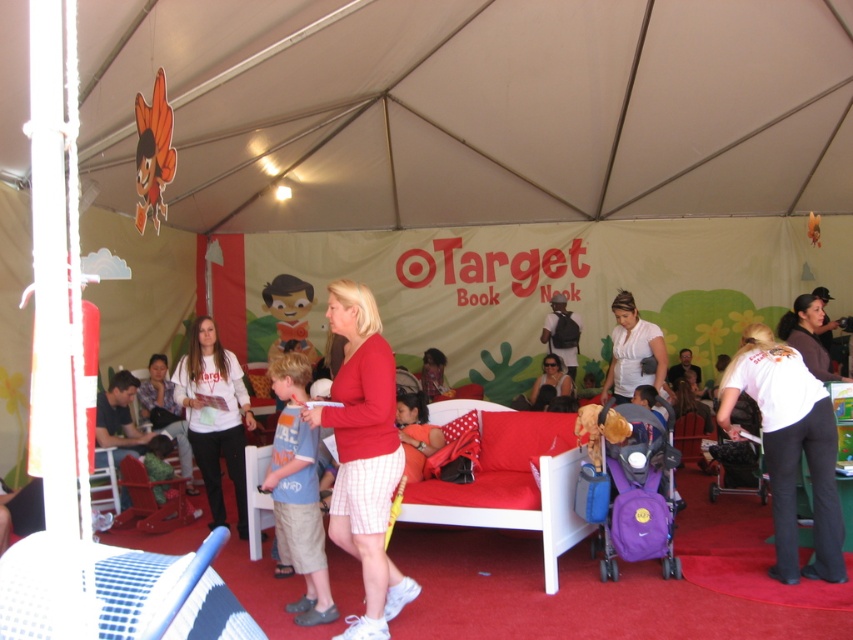
You are organizing a small gift bag for a child and have both the blue cotton shirt at center and the matte plastic toy at center. If you want to ensure the item takes up more space in the bag, which one should you choose?

The blue cotton shirt at center is larger in size than the matte plastic toy at center, so you should choose the blue cotton shirt at center to take up more space in the bag.